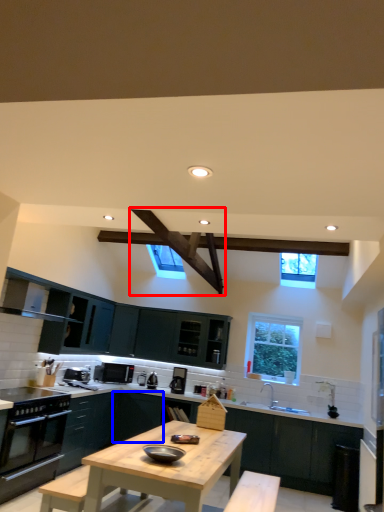
Question: Which object appears closest to the camera in this image, exhaust hood (highlighted by a red box) or cabinetry (highlighted by a blue box)?

Choices:
 (A) exhaust hood
 (B) cabinetry

Answer: (A)